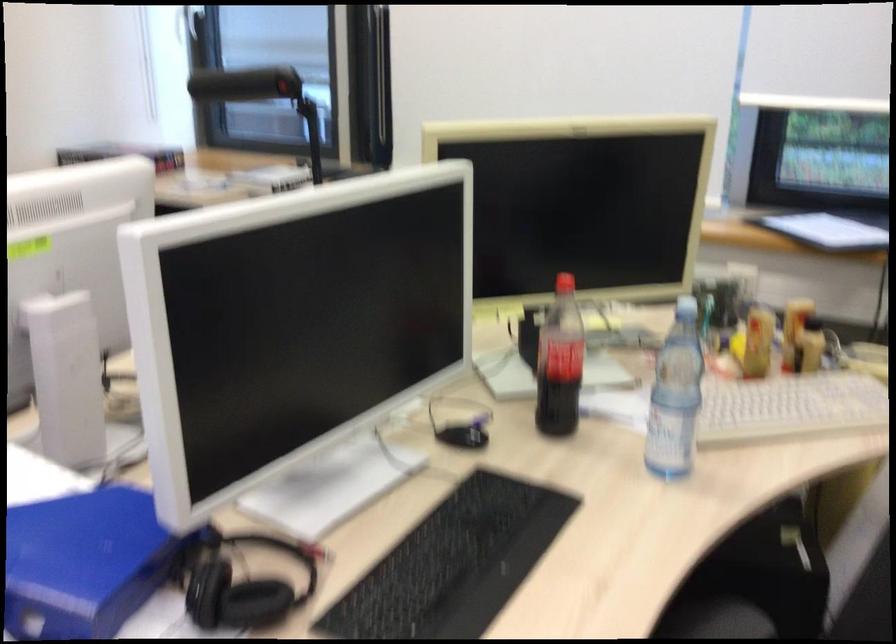
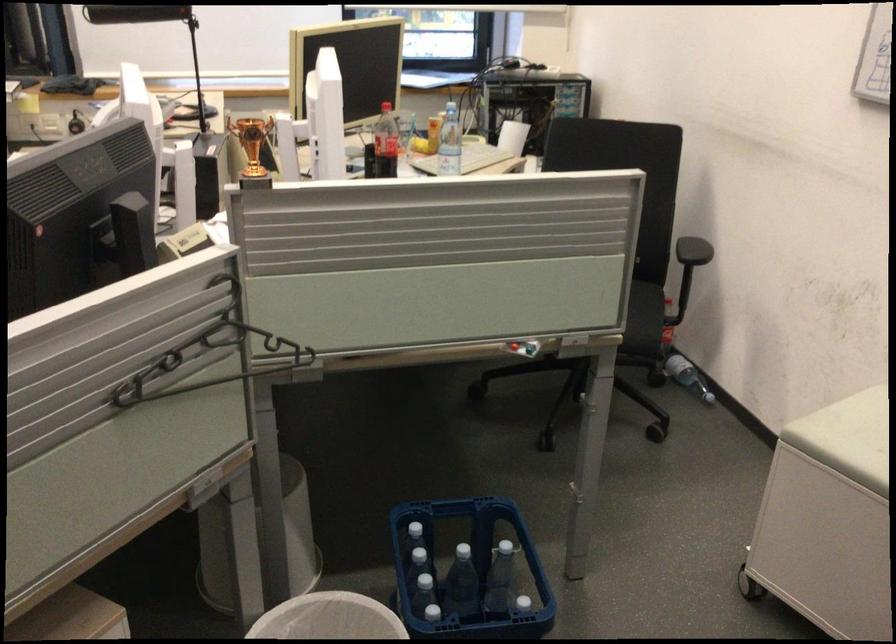
Locate, in the second image, the point that corresponds to (579,359) in the first image.

(385, 143)